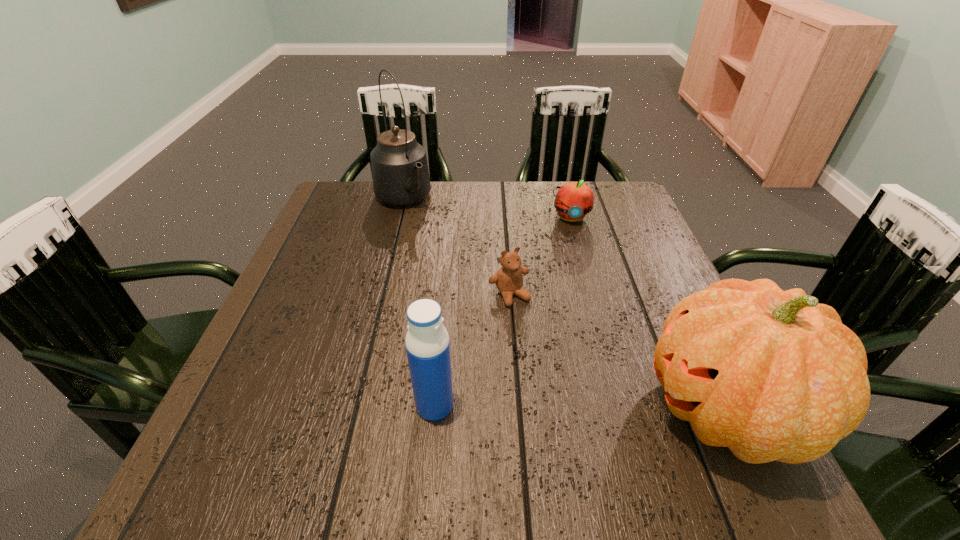
What are the coordinates of `free point between the apple and the second object from left to right` in the screenshot? It's located at (502, 311).

The height and width of the screenshot is (540, 960). I want to click on empty space between the fourth shortest object and the apple, so pos(648,313).

Where is `vacant space that is in between the apple and the second object from left to right`? vacant space that is in between the apple and the second object from left to right is located at coordinates (502, 311).

You are a GUI agent. You are given a task and a screenshot of the screen. Output one action in this format:
    pyautogui.click(x=<x>, y=<y>)
    Task: Click on the free space between the teddy bear and the apple
    The image size is (960, 540).
    Given the screenshot: What is the action you would take?
    pyautogui.click(x=540, y=256)

Find the location of a particular element. free point between the pumpkin and the apple is located at coordinates (648, 313).

Where is `vacant area that lies between the fourth shortest object and the teddy bear`? vacant area that lies between the fourth shortest object and the teddy bear is located at coordinates (617, 352).

Identify which object is the fourth closest to the teddy bear. Please provide its 2D coordinates. Your answer should be formatted as a tuple, i.e. [(x, y)], where the tuple contains the x and y coordinates of a point satisfying the conditions above.

[(400, 173)]

The image size is (960, 540). Find the location of `object identified as the closest to the fourth object from right to left`. object identified as the closest to the fourth object from right to left is located at coordinates (509, 279).

This screenshot has height=540, width=960. In order to click on free space in the image that satisfies the following two spatial constraints: 1. on the front side of the leftmost object; 2. on the left side of the teddy bear in this screenshot , I will do `click(378, 295)`.

Image resolution: width=960 pixels, height=540 pixels. I want to click on free point that satisfies the following two spatial constraints: 1. on the front side of the third shortest object; 2. on the carved face of the fourth shortest object, so click(434, 409).